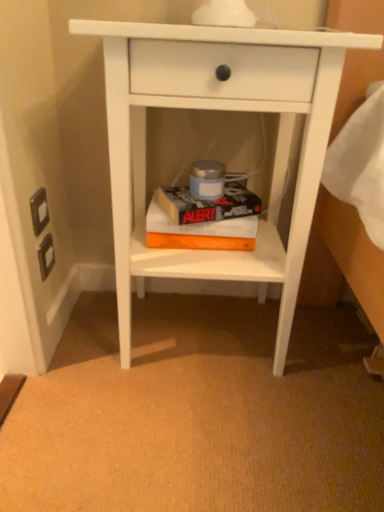
Question: Can you confirm if orange matte paperback book at center, which is the first paperback book from bottom to top, is thinner than hardcover book at center, the 2th paperback book ordered from the bottom?

Choices:
 (A) no
 (B) yes

Answer: (B)

Question: Is the depth of orange matte paperback book at center, which is the 2th paperback book from top to bottom, greater than that of hardcover book at center, the 2th paperback book ordered from the bottom?

Choices:
 (A) no
 (B) yes

Answer: (B)

Question: Is orange matte paperback book at center, which is the first paperback book from bottom to top, oriented towards hardcover book at center, the 2th paperback book ordered from the bottom?

Choices:
 (A) no
 (B) yes

Answer: (A)

Question: Is the position of orange matte paperback book at center, which is the first paperback book from bottom to top, less distant than that of hardcover book at center, which is the 1th paperback book from top to bottom?

Choices:
 (A) yes
 (B) no

Answer: (B)

Question: Does orange matte paperback book at center, which is the 2th paperback book from top to bottom, have a smaller size compared to hardcover book at center, the 2th paperback book ordered from the bottom?

Choices:
 (A) yes
 (B) no

Answer: (B)

Question: In terms of height, does orange matte paperback book at center, which is the first paperback book from bottom to top, look taller or shorter compared to white matte nightstand at center?

Choices:
 (A) short
 (B) tall

Answer: (A)

Question: From the image's perspective, is orange matte paperback book at center, which is the 2th paperback book from top to bottom, positioned above or below white matte nightstand at center?

Choices:
 (A) above
 (B) below

Answer: (B)

Question: Is point (155, 237) positioned closer to the camera than point (299, 47)?

Choices:
 (A) farther
 (B) closer

Answer: (A)

Question: Based on their positions, is orange matte paperback book at center, which is the 2th paperback book from top to bottom, located to the left or right of white matte nightstand at center?

Choices:
 (A) right
 (B) left

Answer: (B)

Question: Considering the positions of orange matte paperback book at center, which is the first paperback book from bottom to top, and hardcover book at center, the 2th paperback book ordered from the bottom, in the image, is orange matte paperback book at center, which is the first paperback book from bottom to top, bigger or smaller than hardcover book at center, the 2th paperback book ordered from the bottom,?

Choices:
 (A) big
 (B) small

Answer: (A)

Question: Do you think orange matte paperback book at center, which is the 2th paperback book from top to bottom, is within hardcover book at center, which is the 1th paperback book from top to bottom, or outside of it?

Choices:
 (A) outside
 (B) inside

Answer: (A)

Question: Relative to hardcover book at center, which is the 1th paperback book from top to bottom, is orange matte paperback book at center, which is the 2th paperback book from top to bottom, in front or behind?

Choices:
 (A) front
 (B) behind

Answer: (B)

Question: Is orange matte paperback book at center, which is the first paperback book from bottom to top, to the left or to the right of hardcover book at center, which is the 1th paperback book from top to bottom, in the image?

Choices:
 (A) right
 (B) left

Answer: (B)

Question: Does point (127, 96) appear closer or farther from the camera than point (188, 223)?

Choices:
 (A) farther
 (B) closer

Answer: (B)

Question: Based on their positions, is white matte nightstand at center located to the left or right of hardcover book at center, the 2th paperback book ordered from the bottom?

Choices:
 (A) left
 (B) right

Answer: (B)